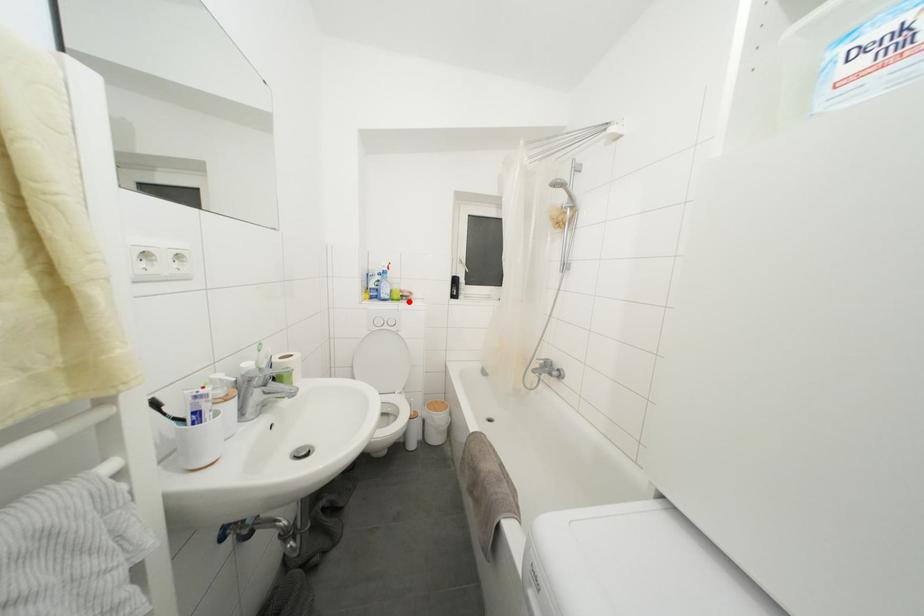
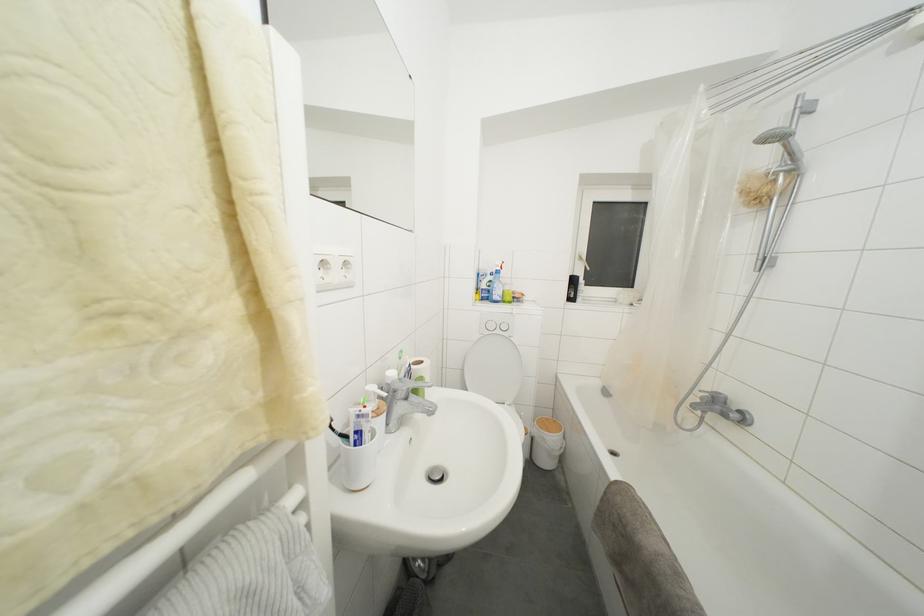
Where in the second image is the point corresponding to the highlighted location from the first image?

(520, 304)